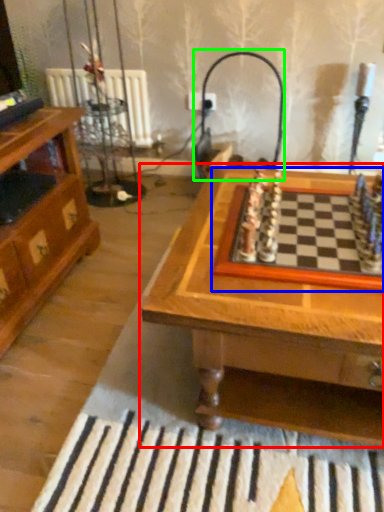
Question: Estimate the real-world distances between objects in this image. Which object is closer to table (highlighted by a red box), board game (highlighted by a blue box) or lamp (highlighted by a green box)?

Choices:
 (A) board game
 (B) lamp

Answer: (A)